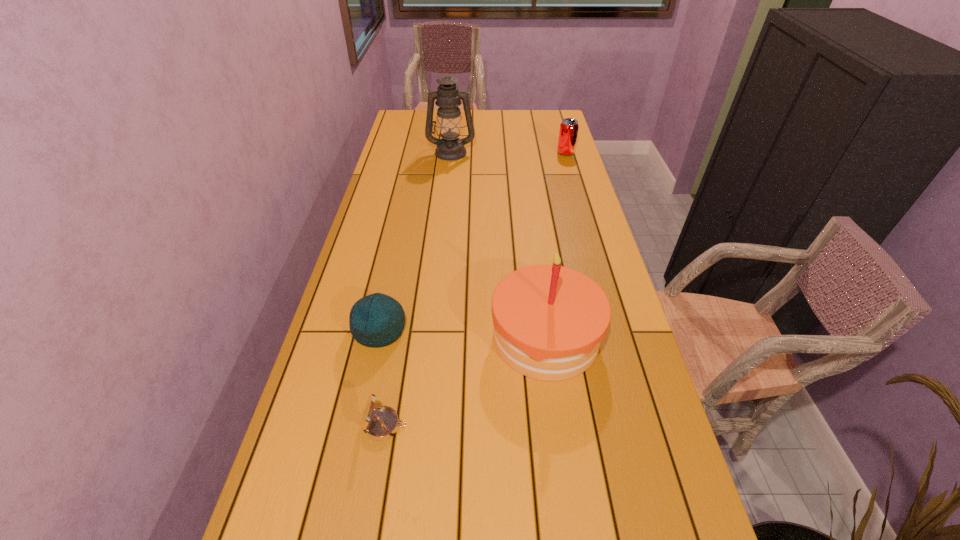
This screenshot has width=960, height=540. I want to click on oil lamp, so click(450, 147).

At what (x,y) coordinates should I click in order to perform the action: click on birthday cake. Please return your answer as a coordinate pair (x, y). This screenshot has height=540, width=960. Looking at the image, I should click on (549, 320).

Find the location of a particular element. This screenshot has width=960, height=540. the rightmost object is located at coordinates (568, 132).

Identify the location of the third tallest object. (568, 132).

Locate an element on the screen. beanie is located at coordinates (376, 320).

This screenshot has height=540, width=960. I want to click on the nearest object, so click(x=381, y=423).

I want to click on the shortest object, so click(381, 423).

At what (x,y) coordinates should I click in order to perform the action: click on vacant area situated 0.240m on the right of the oil lamp. Please return your answer as a coordinate pair (x, y). The width and height of the screenshot is (960, 540). Looking at the image, I should click on (532, 152).

In order to click on free space located 0.380m on the left of the birthday cake in this screenshot , I will do `click(344, 337)`.

Image resolution: width=960 pixels, height=540 pixels. Identify the location of free space located on the back of the soda can. (556, 120).